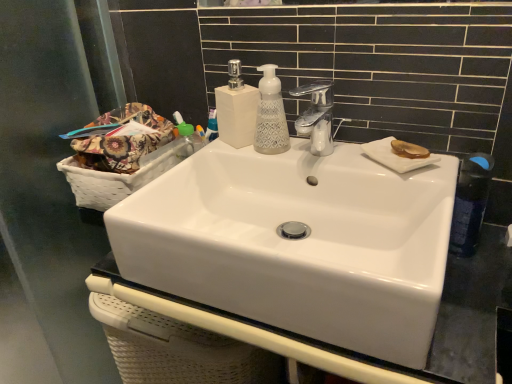
Identify the location of free location to the left of white textured soap dispenser at center, placed as the second soap dispenser when sorted from left to right. This screenshot has width=512, height=384. [212, 160].